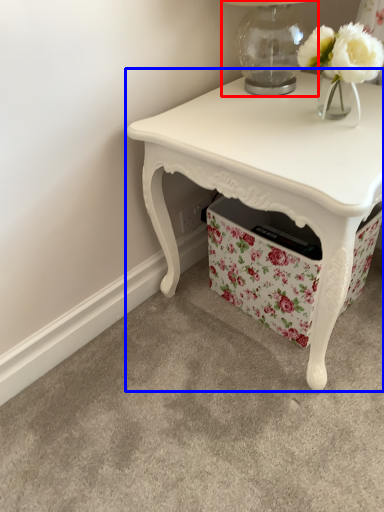
Question: Among these objects, which one is nearest to the camera, table lamp (highlighted by a red box) or table (highlighted by a blue box)?

Choices:
 (A) table lamp
 (B) table

Answer: (B)